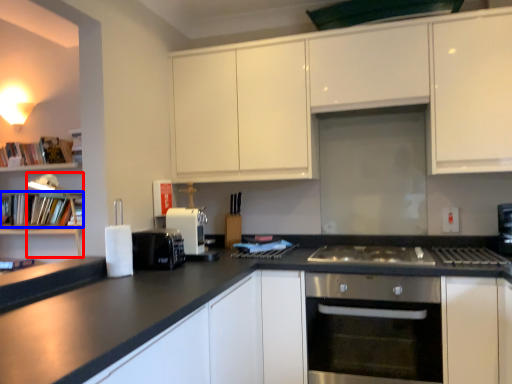
Question: Which point is closer to the camera, lamp (highlighted by a red box) or book (highlighted by a blue box)?

Choices:
 (A) lamp
 (B) book

Answer: (A)